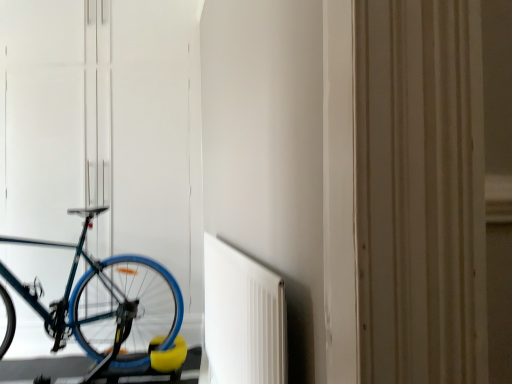
Question: Is white matte radiator at center in front of or behind teal matte bicycle at left in the image?

Choices:
 (A) front
 (B) behind

Answer: (A)

Question: From their relative heights in the image, would you say white matte radiator at center is taller or shorter than teal matte bicycle at left?

Choices:
 (A) tall
 (B) short

Answer: (B)

Question: Is white matte radiator at center bigger or smaller than teal matte bicycle at left?

Choices:
 (A) small
 (B) big

Answer: (A)

Question: Is teal matte bicycle at left bigger or smaller than white matte radiator at center?

Choices:
 (A) small
 (B) big

Answer: (B)

Question: Considering the positions of point (122, 347) and point (234, 382), is point (122, 347) closer or farther from the camera than point (234, 382)?

Choices:
 (A) farther
 (B) closer

Answer: (A)

Question: Is teal matte bicycle at left taller or shorter than white matte radiator at center?

Choices:
 (A) tall
 (B) short

Answer: (A)

Question: Based on their positions, is teal matte bicycle at left located to the left or right of white matte radiator at center?

Choices:
 (A) right
 (B) left

Answer: (B)